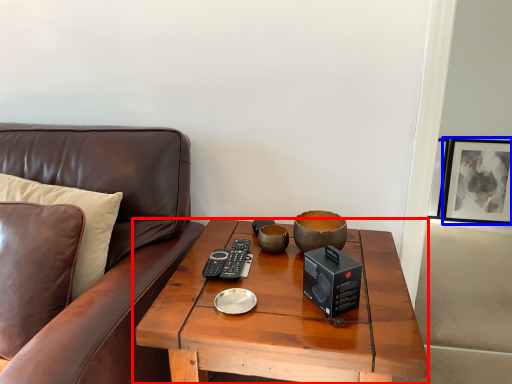
Question: Which object is closer to the camera taking this photo, coffee table (highlighted by a red box) or picture frame (highlighted by a blue box)?

Choices:
 (A) coffee table
 (B) picture frame

Answer: (A)